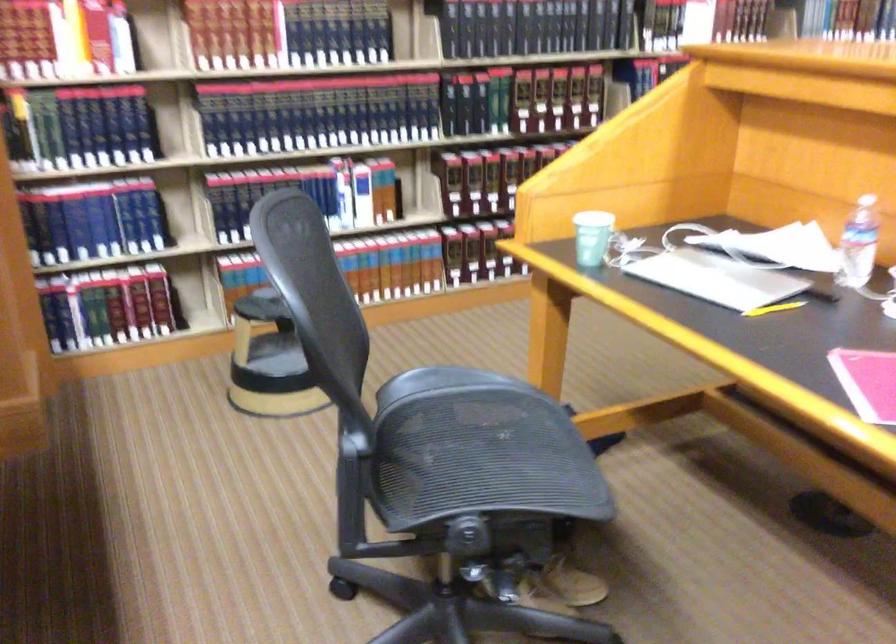
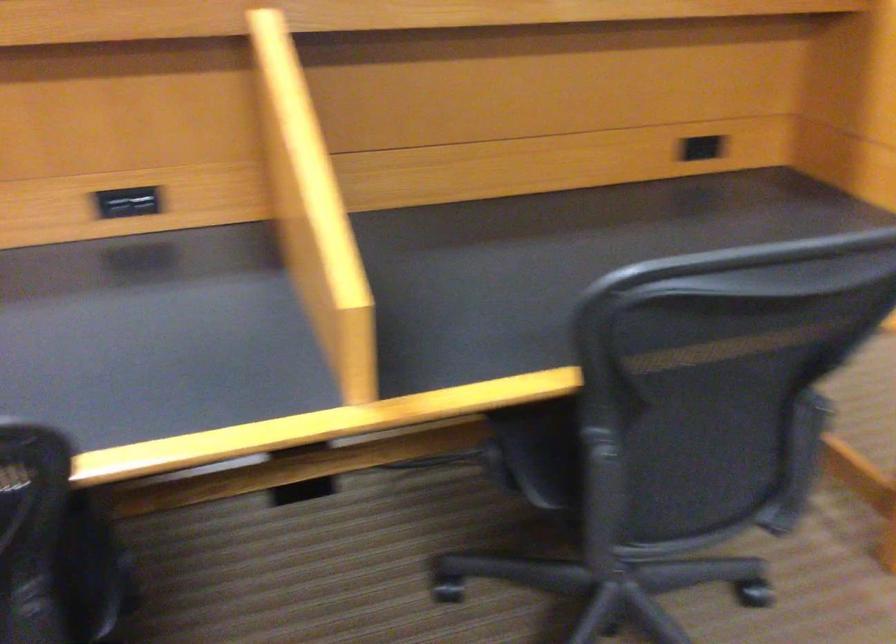
Question: I am providing you with two images of the same scene from different viewpoints. Which of the following objects are not visible in image2?

Choices:
 (A) teal plastic bucket
 (B) closed silver laptop
 (C) black power outlet
 (D) chair sitting surface

Answer: (B)